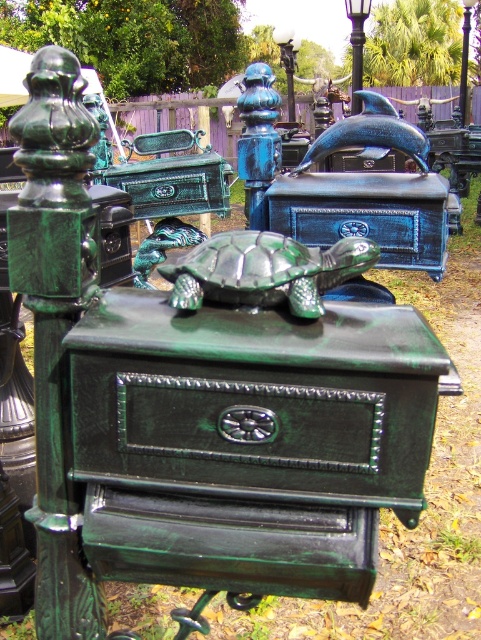
Question: Is the position of green glossy drawer at center less distant than that of green patina lamp post at upper center?

Choices:
 (A) yes
 (B) no

Answer: (A)

Question: Can you confirm if green glossy drawer at center is thinner than polished metal lamp post at center?

Choices:
 (A) yes
 (B) no

Answer: (B)

Question: Is the position of polished metal lamp post at center more distant than that of blue glass lamp post at upper center?

Choices:
 (A) no
 (B) yes

Answer: (A)

Question: Estimate the real-world distances between objects in this image. Which object is closer to the blue glass lamp post at upper center?

Choices:
 (A) green glossy drawer at center
 (B) metallic blue drawer at center

Answer: (B)

Question: Which point is farther to the camera?

Choices:
 (A) (356, 460)
 (B) (465, 51)
 (C) (354, 51)
 (D) (341, 209)

Answer: (B)

Question: Estimate the real-world distances between objects in this image. Which object is closer to the green patina lamp post at upper center?

Choices:
 (A) polished metal lamp post at center
 (B) blue glass lamp post at upper center
 (C) metallic blue drawer at center

Answer: (B)